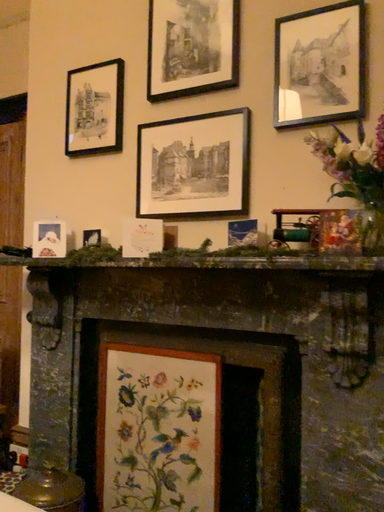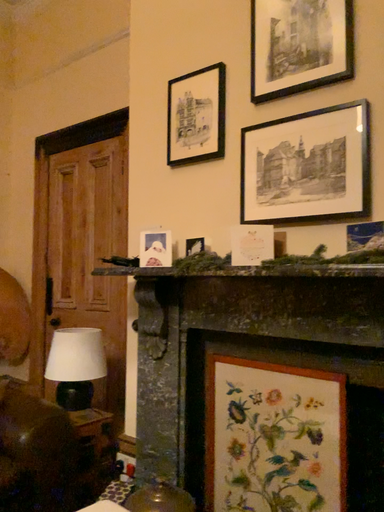
Question: How did the camera likely rotate when shooting the video?

Choices:
 (A) rotated right
 (B) rotated left

Answer: (B)